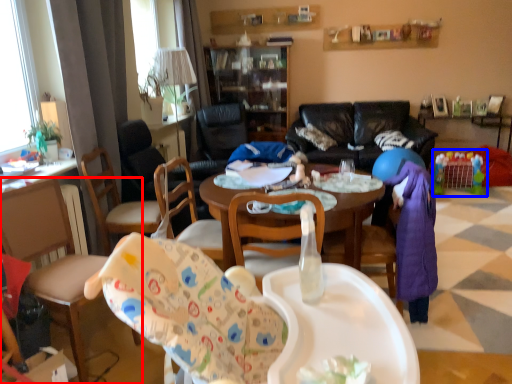
Question: Which object appears closest to the camera in this image, chair (highlighted by a red box) or toy (highlighted by a blue box)?

Choices:
 (A) chair
 (B) toy

Answer: (A)